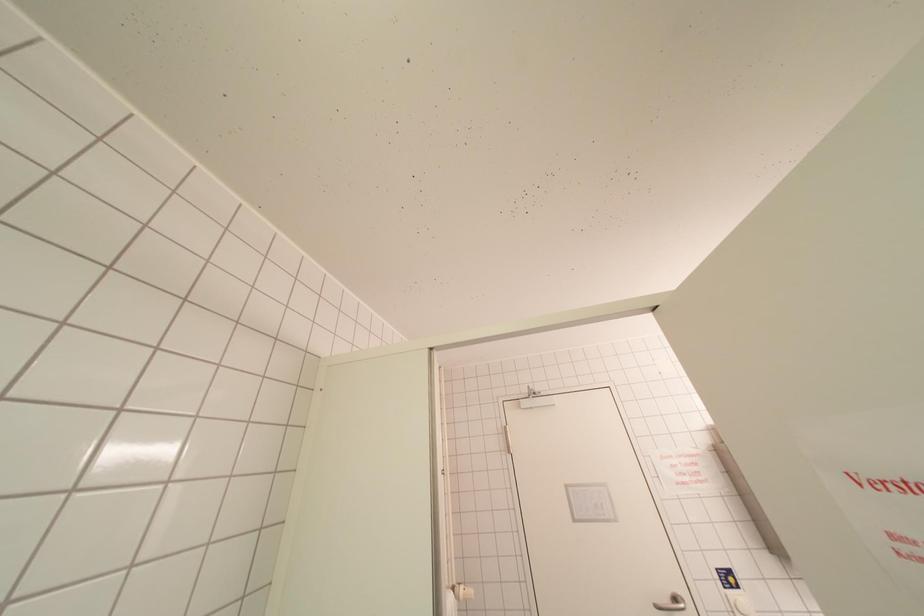
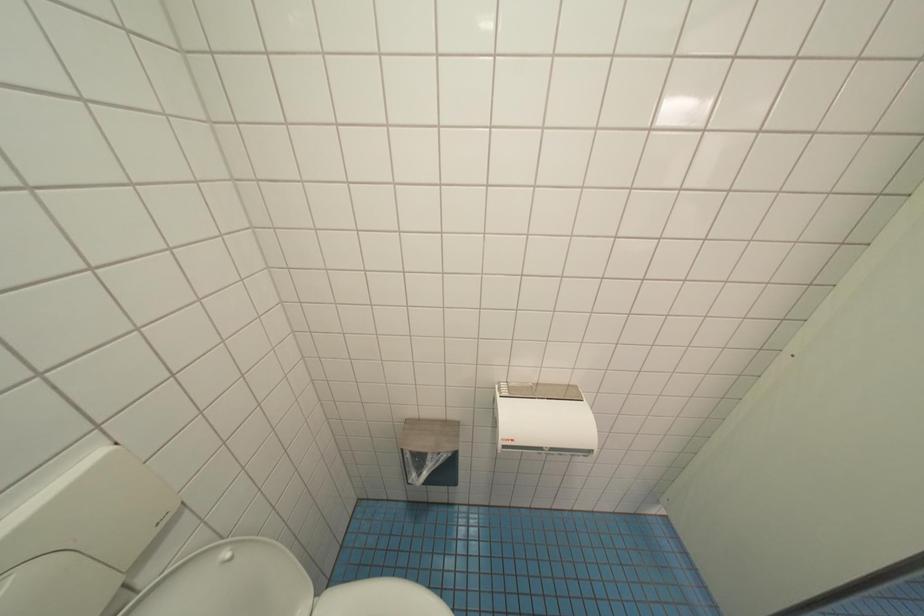
How did the camera likely rotate?

The camera's rotation is toward left-down.